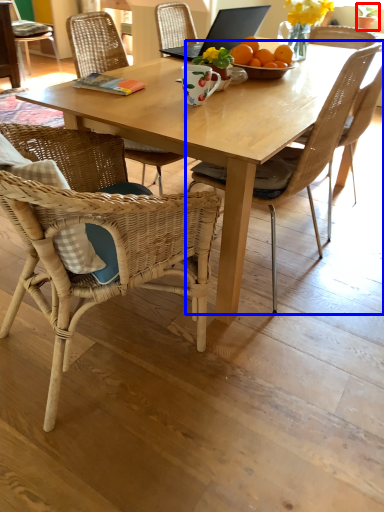
Question: Which object appears closest to the camera in this image, houseplant (highlighted by a red box) or chair (highlighted by a blue box)?

Choices:
 (A) houseplant
 (B) chair

Answer: (B)